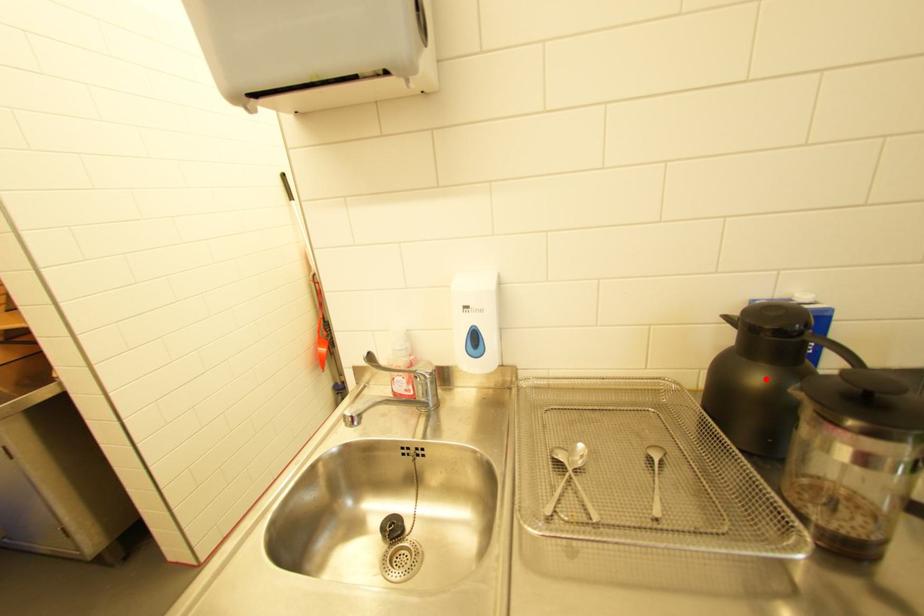
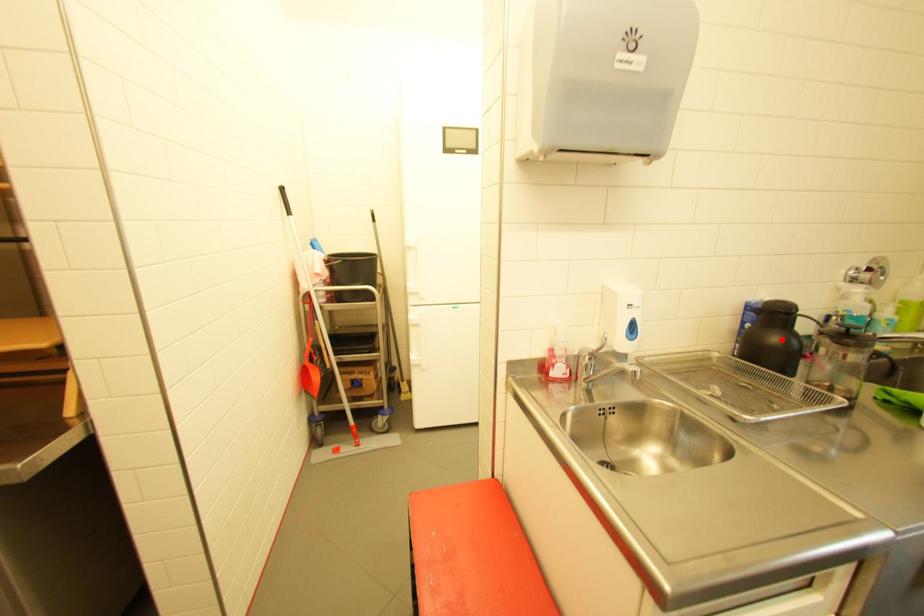
I am providing you with two images of the same scene from different viewpoints. A red point is marked on the first image and another point is marked on the second image. Is the marked point in image1 the same physical position as the marked point in image2?

Yes